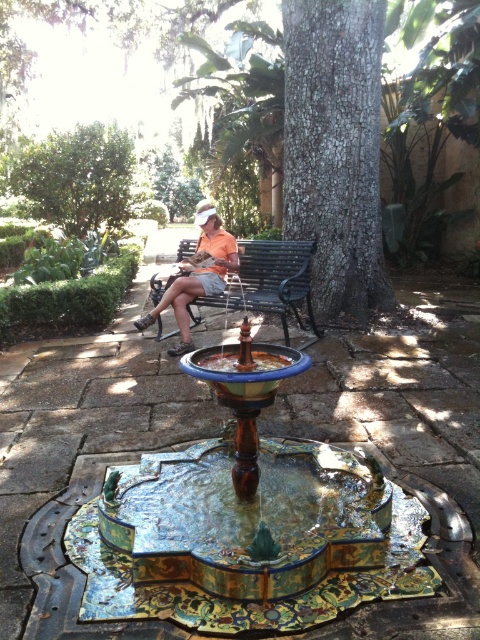
Is green leafy tree at upper left bigger than matte orange shirt at center?

Yes.

Does point (52, 209) come farther from viewer compared to point (212, 244)?

Yes, point (52, 209) is farther from viewer.

Between point (14, 184) and point (218, 253), which one is positioned in front?

Point (218, 253)

Where is `green leafy tree at upper left`? The width and height of the screenshot is (480, 640). green leafy tree at upper left is located at coordinates (76, 179).

Who is lower down, brown rough bark tree at center or matte orange shirt at center?

matte orange shirt at center is below.

Does brown rough bark tree at center appear over matte orange shirt at center?

Yes.

Is point (376, 150) positioned after point (182, 298)?

Yes, it is behind point (182, 298).

I want to click on brown rough bark tree at center, so click(x=336, y=150).

Does shiny ceramic fountain at center have a lesser height compared to black metal bench at center?

Yes, shiny ceramic fountain at center is shorter than black metal bench at center.

Which is more to the left, shiny ceramic fountain at center or black metal bench at center?

From the viewer's perspective, shiny ceramic fountain at center appears more on the left side.

Is point (112, 515) closer to camera compared to point (159, 324)?

Yes, it is.

Image resolution: width=480 pixels, height=640 pixels. I want to click on shiny ceramic fountain at center, so click(x=247, y=522).